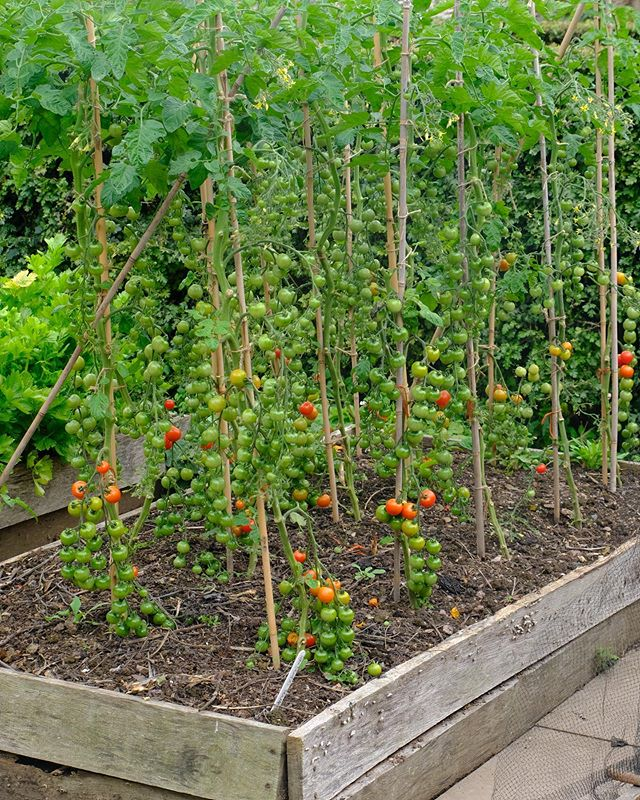
Where is `wooden planks`? The height and width of the screenshot is (800, 640). wooden planks is located at coordinates (129, 734), (65, 782), (90, 740), (393, 714), (442, 741), (45, 498), (50, 522), (625, 462).